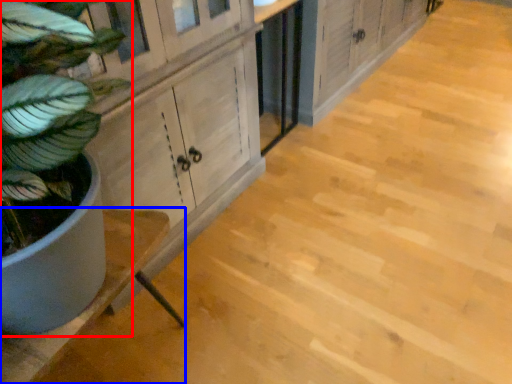
Question: Which of the following is the farthest to the observer, houseplant (highlighted by a red box) or counter (highlighted by a blue box)?

Choices:
 (A) houseplant
 (B) counter

Answer: (B)